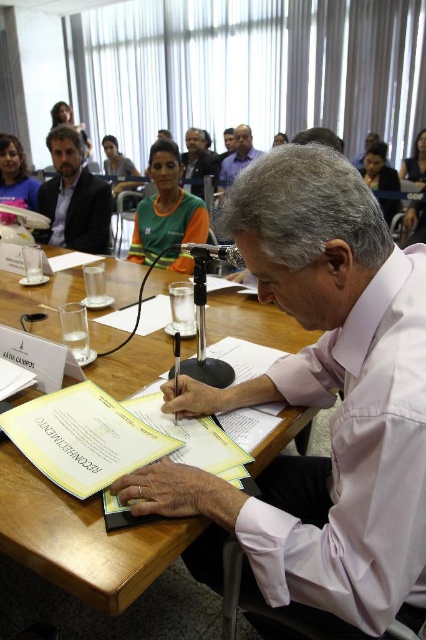
Between matte black suit at left and matte blue shirt at upper center, which one has less height?

matte black suit at left is shorter.

You are a GUI agent. You are given a task and a screenshot of the screen. Output one action in this format:
    pyautogui.click(x=<x>, y=<y>)
    Task: Click on the matte black suit at left
    This screenshot has width=426, height=640.
    Given the screenshot: What is the action you would take?
    pyautogui.click(x=74, y=198)

Is point (66, 134) positioned after point (226, 163)?

No, (66, 134) is closer to viewer.

Where is `matte black suit at left`? matte black suit at left is located at coordinates (74, 198).

Does matte black suit at left come behind green jersey at center?

That is True.

Is matte black suit at left bigger than green jersey at center?

Correct, matte black suit at left is larger in size than green jersey at center.

Between point (58, 166) and point (192, 195), which one is positioned in front?

Positioned in front is point (58, 166).

Image resolution: width=426 pixels, height=640 pixels. Find the location of `matte black suit at left`. matte black suit at left is located at coordinates (74, 198).

What do you see at coordinates (80, 538) in the screenshot?
I see `wooden table at center` at bounding box center [80, 538].

Is point (152, 532) more distant than point (196, 161)?

No, (152, 532) is in front of (196, 161).

Is point (34, 493) more distant than point (189, 128)?

That is False.

The height and width of the screenshot is (640, 426). Identify the location of wooden table at center. (80, 538).